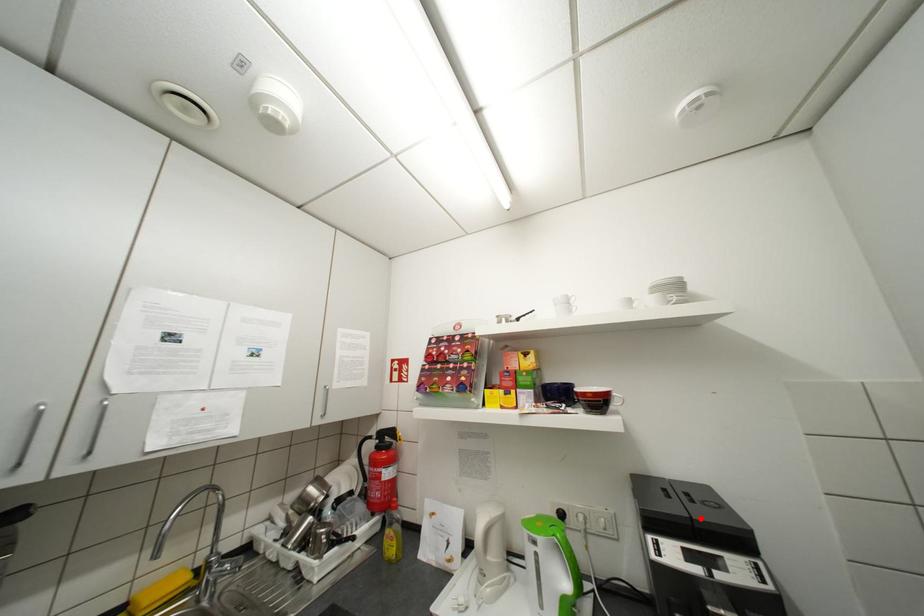
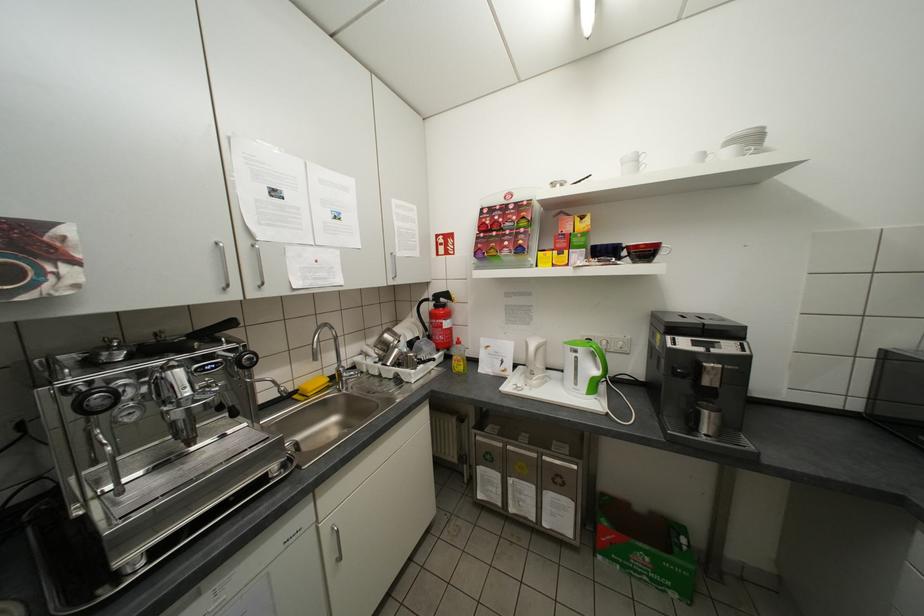
The point at the highlighted location is marked in the first image. Where is the corresponding point in the second image?

(712, 323)